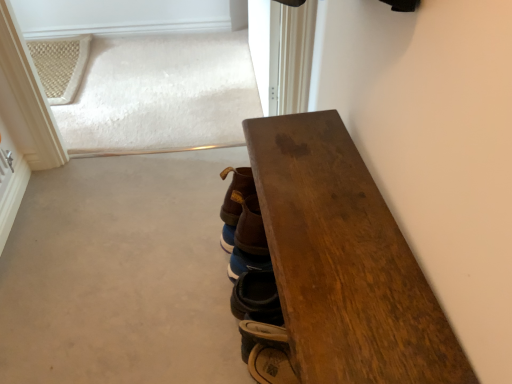
I want to click on brown leather boot at center, marked as the 2th footwear in a bottom-to-top arrangement, so click(234, 203).

Which of these two, wooden table at right or brown leather boot at lower center, which appears as the 1th footwear when ordered from the bottom, is smaller?

With smaller size is brown leather boot at lower center, which appears as the 1th footwear when ordered from the bottom.

Would you say wooden table at right is a long distance from brown leather boot at lower center, which ranks as the 2th footwear in top-to-bottom order?

They are positioned close to each other.

Does wooden table at right turn towards brown leather boot at lower center, which appears as the 1th footwear when ordered from the bottom?

Yes, wooden table at right is facing brown leather boot at lower center, which appears as the 1th footwear when ordered from the bottom.

Looking at their sizes, would you say wooden table at right is wider or thinner than brown leather boot at lower center, which ranks as the 2th footwear in top-to-bottom order?

Considering their sizes, wooden table at right looks broader than brown leather boot at lower center, which ranks as the 2th footwear in top-to-bottom order.

Locate an element on the screen. The height and width of the screenshot is (384, 512). footwear in front of the brown leather boot at lower center, which appears as the 1th footwear when ordered from the bottom is located at coordinates (234, 203).

Can you confirm if brown leather boot at lower center, which appears as the 1th footwear when ordered from the bottom, is wider than brown leather boot at center, marked as the first footwear in a top-to-bottom arrangement?

In fact, brown leather boot at lower center, which appears as the 1th footwear when ordered from the bottom, might be narrower than brown leather boot at center, marked as the first footwear in a top-to-bottom arrangement.

Is brown leather boot at lower center, which ranks as the 2th footwear in top-to-bottom order, shorter than brown leather boot at center, marked as the 2th footwear in a bottom-to-top arrangement?

Indeed, brown leather boot at lower center, which ranks as the 2th footwear in top-to-bottom order, has a lesser height compared to brown leather boot at center, marked as the 2th footwear in a bottom-to-top arrangement.

Would you say brown leather boot at lower center, which appears as the 1th footwear when ordered from the bottom, is to the left or to the right of brown leather boot at center, marked as the 2th footwear in a bottom-to-top arrangement, in the picture?

Based on their positions, brown leather boot at lower center, which appears as the 1th footwear when ordered from the bottom, is located to the right of brown leather boot at center, marked as the 2th footwear in a bottom-to-top arrangement.

Looking at the image, does wooden table at right seem bigger or smaller compared to brown leather boot at center, marked as the first footwear in a top-to-bottom arrangement?

Considering their sizes, wooden table at right takes up more space than brown leather boot at center, marked as the first footwear in a top-to-bottom arrangement.

From a real-world perspective, who is located higher, wooden table at right or brown leather boot at center, marked as the first footwear in a top-to-bottom arrangement?

brown leather boot at center, marked as the first footwear in a top-to-bottom arrangement, is physically above.

From the image's perspective, which one is positioned higher, wooden table at right or brown leather boot at center, marked as the first footwear in a top-to-bottom arrangement?

brown leather boot at center, marked as the first footwear in a top-to-bottom arrangement, from the image's perspective.

In the image, is brown leather boot at center, marked as the first footwear in a top-to-bottom arrangement, positioned in front of or behind wooden table at right?

In the image, brown leather boot at center, marked as the first footwear in a top-to-bottom arrangement, appears behind wooden table at right.

Considering the sizes of objects brown leather boot at center, marked as the 2th footwear in a bottom-to-top arrangement, and wooden table at right in the image provided, who is shorter, brown leather boot at center, marked as the 2th footwear in a bottom-to-top arrangement, or wooden table at right?

brown leather boot at center, marked as the 2th footwear in a bottom-to-top arrangement.

From the image's perspective, which is below, brown leather boot at center, marked as the 2th footwear in a bottom-to-top arrangement, or wooden table at right?

From the image's view, wooden table at right is below.

From a real-world perspective, is brown leather boot at center, marked as the first footwear in a top-to-bottom arrangement, physically above wooden table at right?

Correct, in the physical world, brown leather boot at center, marked as the first footwear in a top-to-bottom arrangement, is higher than wooden table at right.

Which is behind, brown leather boot at lower center, which appears as the 1th footwear when ordered from the bottom, or wooden table at right?

brown leather boot at lower center, which appears as the 1th footwear when ordered from the bottom.

Considering the sizes of objects brown leather boot at lower center, which ranks as the 2th footwear in top-to-bottom order, and wooden table at right in the image provided, who is bigger, brown leather boot at lower center, which ranks as the 2th footwear in top-to-bottom order, or wooden table at right?

wooden table at right is bigger.

Considering the sizes of objects brown leather boot at lower center, which appears as the 1th footwear when ordered from the bottom, and wooden table at right in the image provided, who is thinner, brown leather boot at lower center, which appears as the 1th footwear when ordered from the bottom, or wooden table at right?

brown leather boot at lower center, which appears as the 1th footwear when ordered from the bottom, is thinner.

Is brown leather boot at lower center, which appears as the 1th footwear when ordered from the bottom, touching wooden table at right?

No, brown leather boot at lower center, which appears as the 1th footwear when ordered from the bottom, is not touching wooden table at right.

Can you tell me how much brown leather boot at center, marked as the 2th footwear in a bottom-to-top arrangement, and brown leather boot at lower center, which appears as the 1th footwear when ordered from the bottom, differ in facing direction?

The angular difference between brown leather boot at center, marked as the 2th footwear in a bottom-to-top arrangement, and brown leather boot at lower center, which appears as the 1th footwear when ordered from the bottom, is 0.00362 degrees.

Which is behind, point (247, 190) or point (230, 276)?

Point (230, 276)

In the image, is brown leather boot at center, marked as the first footwear in a top-to-bottom arrangement, positioned in front of or behind brown leather boot at lower center, which ranks as the 2th footwear in top-to-bottom order?

brown leather boot at center, marked as the first footwear in a top-to-bottom arrangement, is in front of brown leather boot at lower center, which ranks as the 2th footwear in top-to-bottom order.

How far apart are brown leather boot at center, marked as the 2th footwear in a bottom-to-top arrangement, and brown leather boot at lower center, which ranks as the 2th footwear in top-to-bottom order?

brown leather boot at center, marked as the 2th footwear in a bottom-to-top arrangement, and brown leather boot at lower center, which ranks as the 2th footwear in top-to-bottom order, are 3.90 inches apart.

Where is `the 2nd footwear behind the wooden table at right`? the 2nd footwear behind the wooden table at right is located at coordinates (246, 263).

At what (x,y) coordinates should I click in order to perform the action: click on footwear on the left of brown leather boot at lower center, which appears as the 1th footwear when ordered from the bottom. Please return your answer as a coordinate pair (x, y). Looking at the image, I should click on (234, 203).

Which object lies further to the anchor point brown leather boot at center, marked as the 2th footwear in a bottom-to-top arrangement, brown leather boot at lower center, which appears as the 1th footwear when ordered from the bottom, or wooden table at right?

Among the two, wooden table at right is located further to brown leather boot at center, marked as the 2th footwear in a bottom-to-top arrangement.

Considering their positions, is brown leather boot at lower center, which appears as the 1th footwear when ordered from the bottom, positioned closer to wooden table at right than brown leather boot at center, marked as the 2th footwear in a bottom-to-top arrangement?

brown leather boot at center, marked as the 2th footwear in a bottom-to-top arrangement, is closer to wooden table at right.

From the image, which object appears to be nearer to brown leather boot at lower center, which appears as the 1th footwear when ordered from the bottom, brown leather boot at center, marked as the first footwear in a top-to-bottom arrangement, or wooden table at right?

brown leather boot at center, marked as the first footwear in a top-to-bottom arrangement, is positioned closer to the anchor brown leather boot at lower center, which appears as the 1th footwear when ordered from the bottom.

Considering their positions, is wooden table at right positioned closer to brown leather boot at lower center, which appears as the 1th footwear when ordered from the bottom, than brown leather boot at center, marked as the first footwear in a top-to-bottom arrangement?

brown leather boot at center, marked as the first footwear in a top-to-bottom arrangement.

Based on the photo, considering their positions, is brown leather boot at center, marked as the first footwear in a top-to-bottom arrangement, positioned further to wooden table at right than brown leather boot at lower center, which appears as the 1th footwear when ordered from the bottom?

Based on the image, brown leather boot at lower center, which appears as the 1th footwear when ordered from the bottom, appears to be further to wooden table at right.

Based on their spatial positions, is wooden table at right or brown leather boot at lower center, which appears as the 1th footwear when ordered from the bottom, further from brown leather boot at center, marked as the 2th footwear in a bottom-to-top arrangement?

wooden table at right is positioned further to the anchor brown leather boot at center, marked as the 2th footwear in a bottom-to-top arrangement.

Locate an element on the screen. The height and width of the screenshot is (384, 512). footwear between wooden table at right and brown leather boot at lower center, which appears as the 1th footwear when ordered from the bottom, along the z-axis is located at coordinates (234, 203).